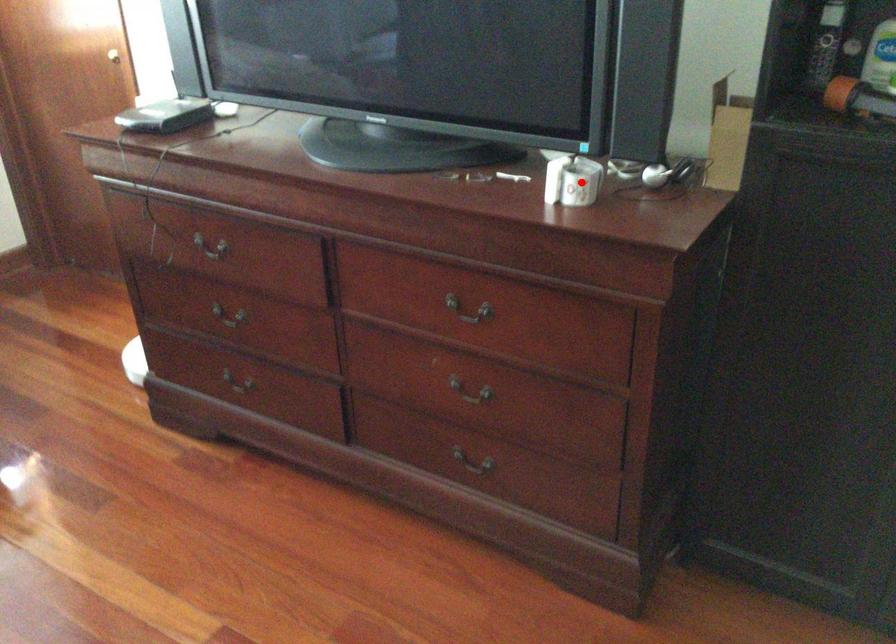
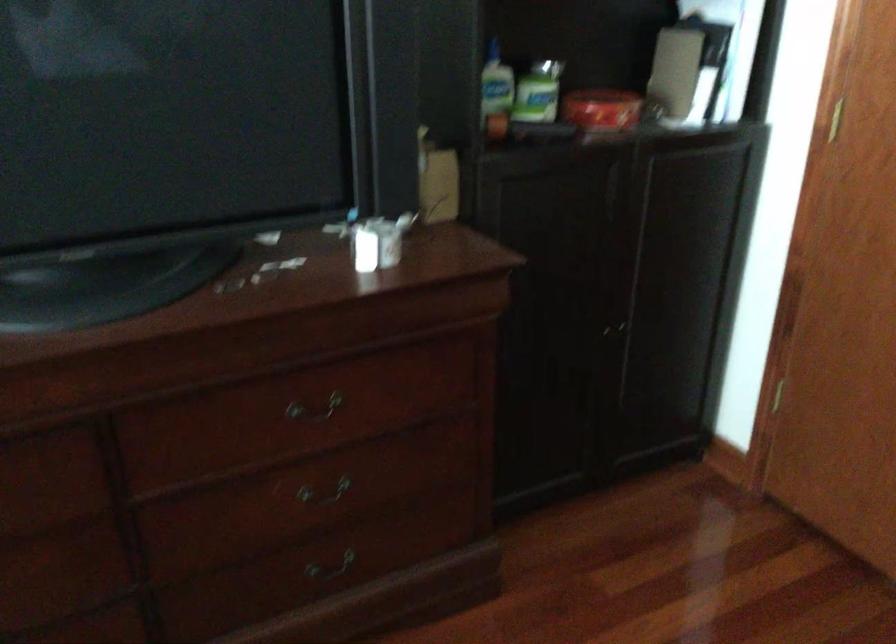
Where in the second image is the point corresponding to the highlighted location from the first image?

(378, 242)